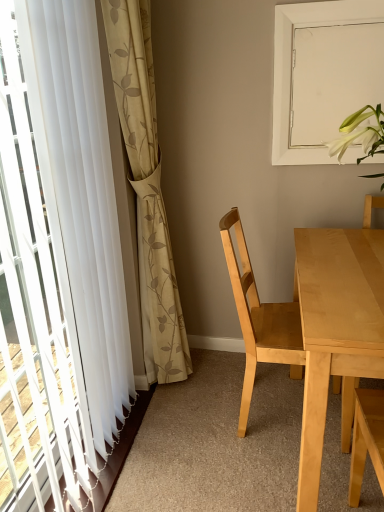
The image size is (384, 512). What are the coordinates of `vacant space to the left of light wood chair at center` in the screenshot? It's located at (199, 436).